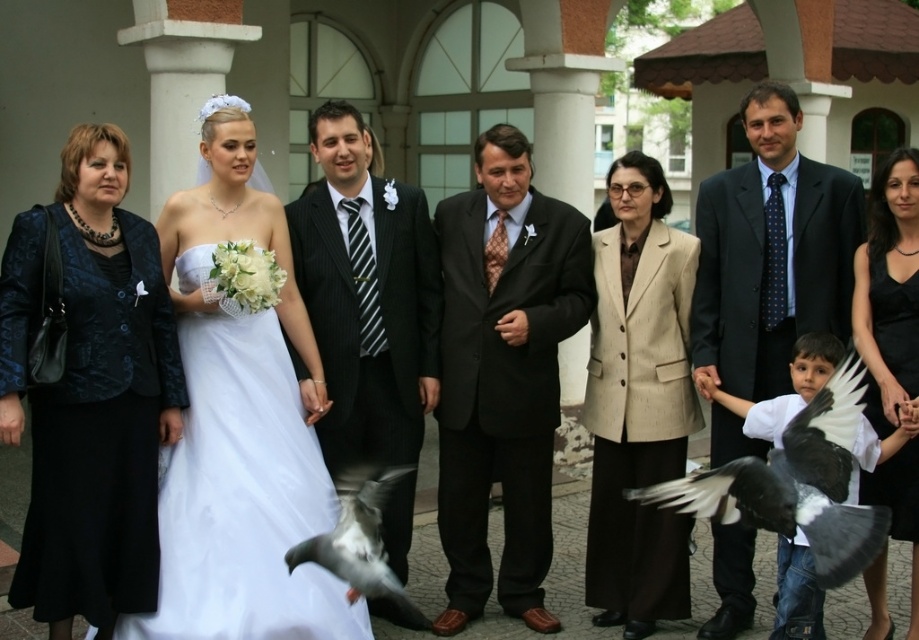
Question: Can you confirm if dark blue suit at center is bigger than beige textured blazer at center?

Choices:
 (A) no
 (B) yes

Answer: (B)

Question: Estimate the real-world distances between objects in this image. Which object is farther from the matte black suit at center?

Choices:
 (A) black pinstripe suit at center
 (B) white satin dress at center
 (C) dark blue suit at center

Answer: (C)

Question: Based on their relative distances, which object is farther from the matte black suit at center?

Choices:
 (A) black feathered bird at lower right
 (B) white satin dress at center
 (C) black pinstripe suit at center
 (D) black satin dress at center

Answer: (D)

Question: Does velvet blue blazer at left appear over black feathered bird at lower right?

Choices:
 (A) yes
 (B) no

Answer: (A)

Question: Which of the following is the closest to the observer?

Choices:
 (A) (604, 294)
 (B) (796, 292)
 (C) (845, 554)
 (D) (259, 486)

Answer: (C)

Question: Where is velvet blue blazer at left located in relation to matte black suit at center in the image?

Choices:
 (A) below
 (B) above

Answer: (B)